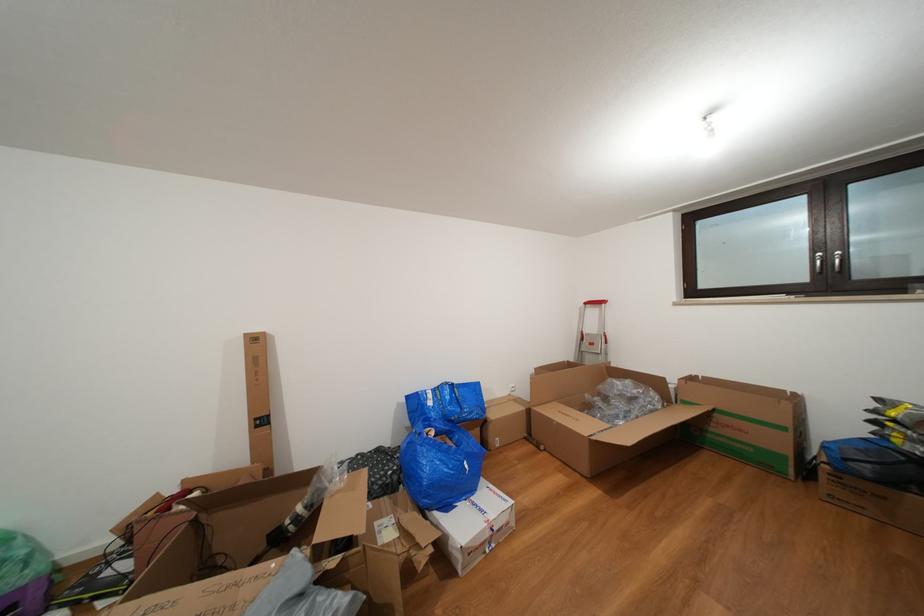
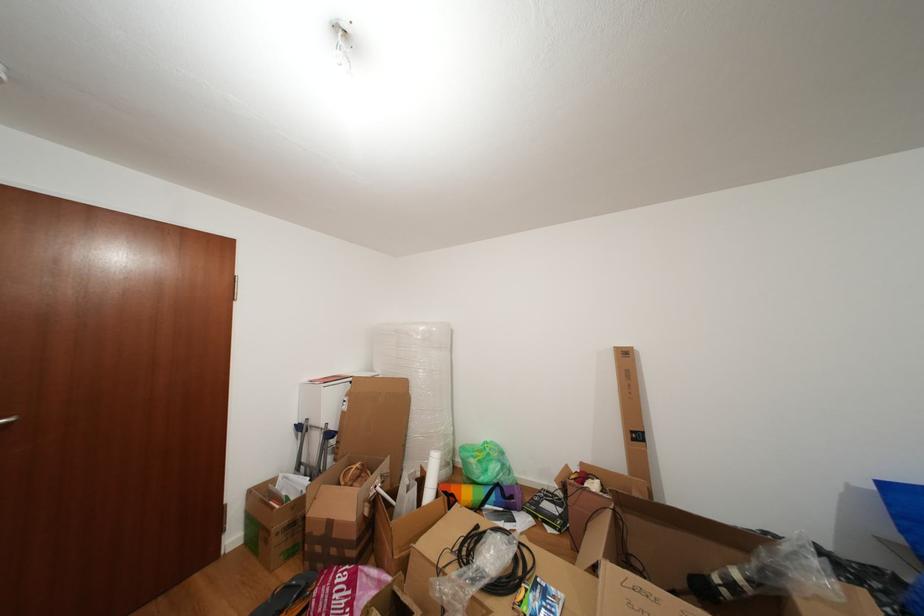
Find the pixel in the second image that matches (x=373, y=475) in the first image.

(871, 598)